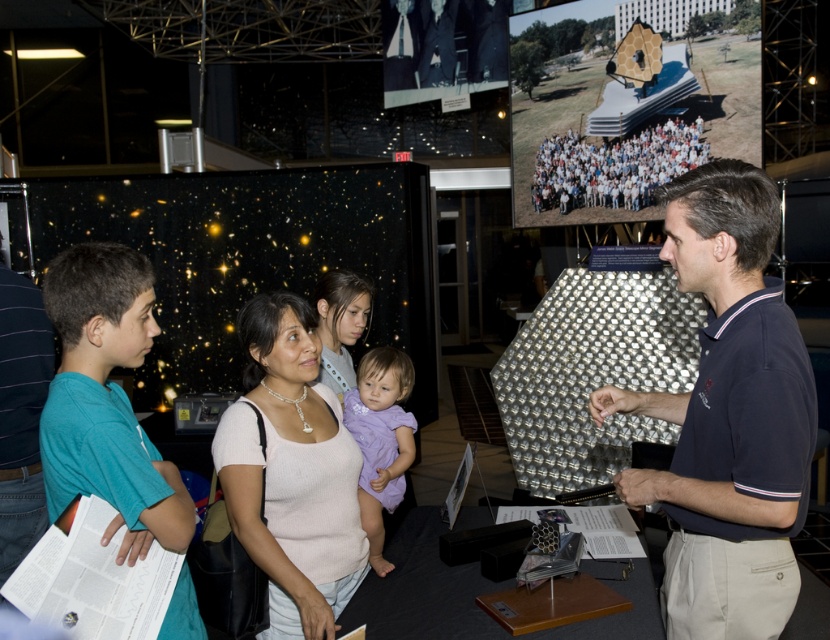
You are standing in a museum and want to take a photo of the pink ribbed sweater at center without getting too close. If your camera can focus up to 6 feet away, will you be able to capture it clearly?

The pink ribbed sweater at center is 5.59 feet away from the viewer, which is within the camera focus range of 6 feet. Therefore, you can capture it clearly without moving closer.

You are a museum guide who needs to arrange two shirts for an exhibit. The dark blue polo shirt at center and the striped cotton shirt at left are available. Which shirt should be placed higher to match their current positions?

The dark blue polo shirt at center should be placed higher because it is positioned over the striped cotton shirt at left in their current arrangement.

Please look at the coordinates point at (728, 417). Which object in the scene is this point located on?

The point at (728, 417) is located on the dark blue polo shirt at center.